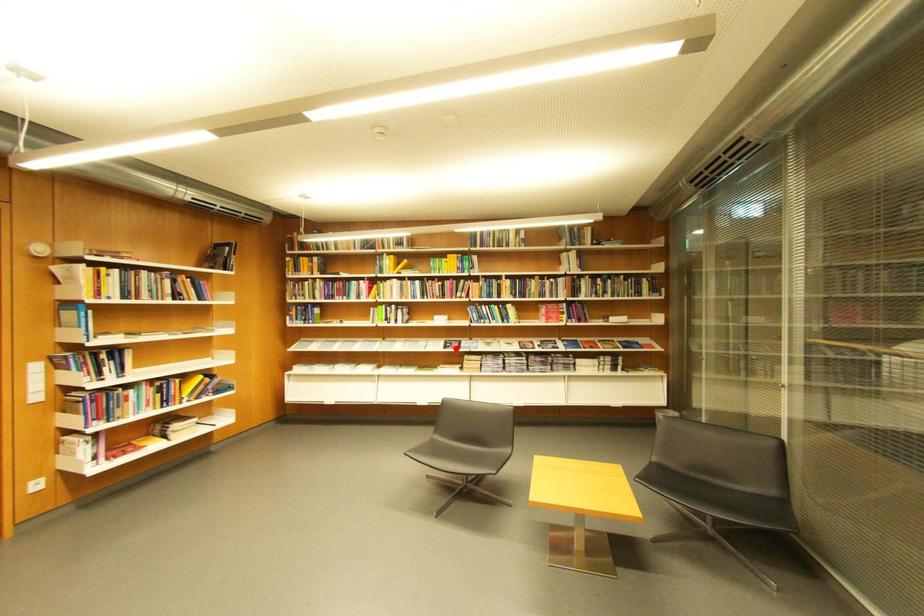
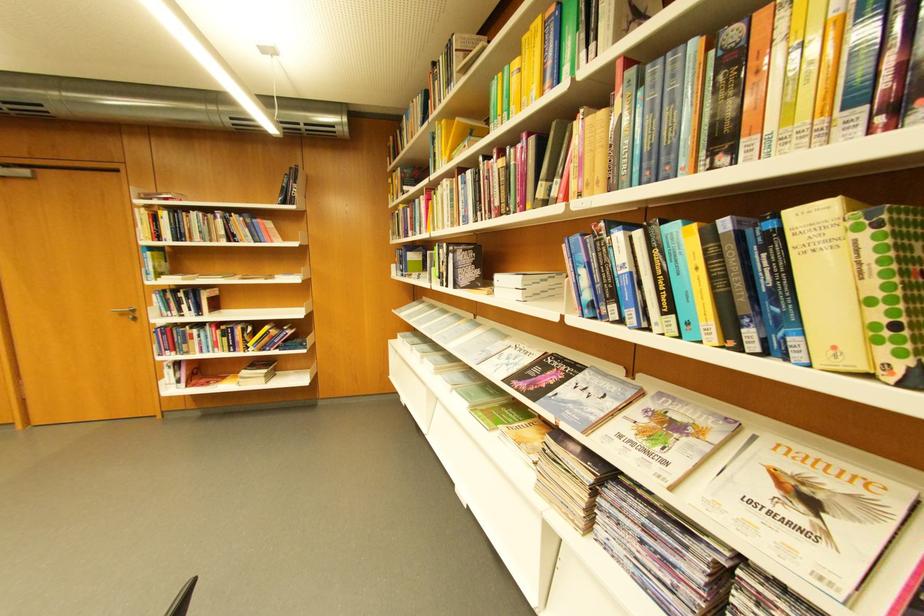
In the second image, find the point that corresponds to the highlighted location in the first image.

(532, 377)